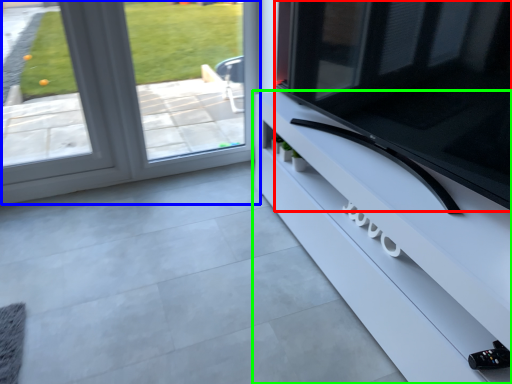
Question: Which is farther away from television (highlighted by a red box)? window (highlighted by a blue box) or furniture (highlighted by a green box)?

Choices:
 (A) window
 (B) furniture

Answer: (A)